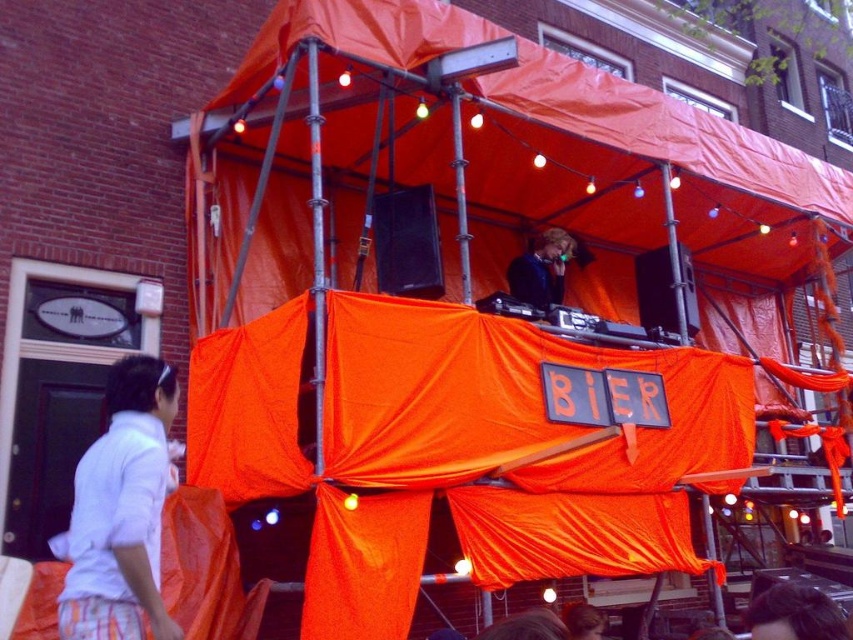
You are at the event and want to find the DJ. According to the coordinates provided, where should you look to find the blonde hair dj at center?

The blonde hair dj at center is located at point coordinates (541,268).